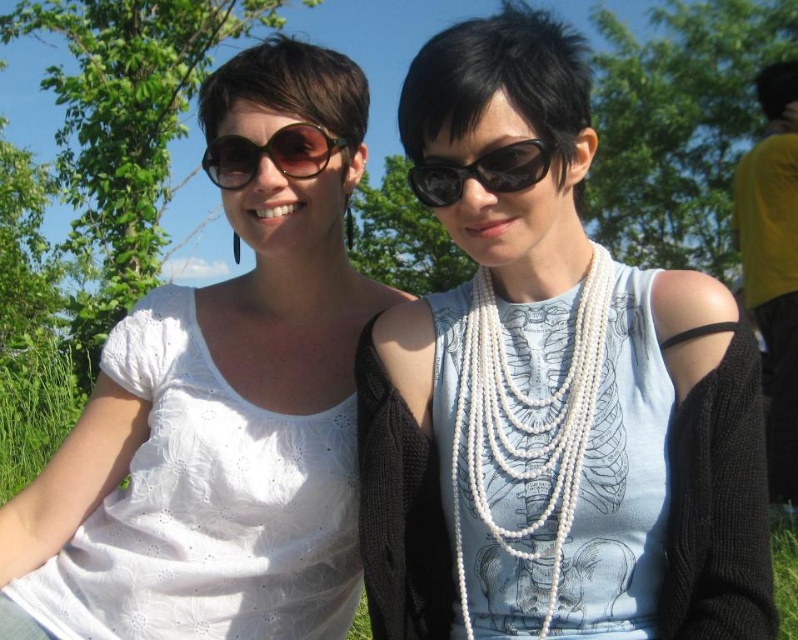
You are an artist trying to sketch the scene. You want to place the white pearl necklace at center accurately in your drawing. According to the image, where should you position it?

The white pearl necklace at center should be positioned at the coordinates point (524, 422).

You are standing in a park and want to take a photo of the person at point (449, 467). If your camera has a maximum focus range of 1.5 meters, will you need to move closer to get a clear shot?

The point (449, 467) is 1.66 meters away from the viewer. Since the camera can only focus up to 1.5 meters, you need to move closer to ensure the person is in focus.

You are a photographer planning to capture a closeup shot of the pearl necklace at center and the matte black sunglasses at upper center. Since you want to ensure both items are in focus, you need to know which object is wider. Can you tell me which one is wider?

The pearl necklace at center is wider than the matte black sunglasses at upper center according to the description, so you should adjust your camera settings to accommodate the wider pearl necklace at center.